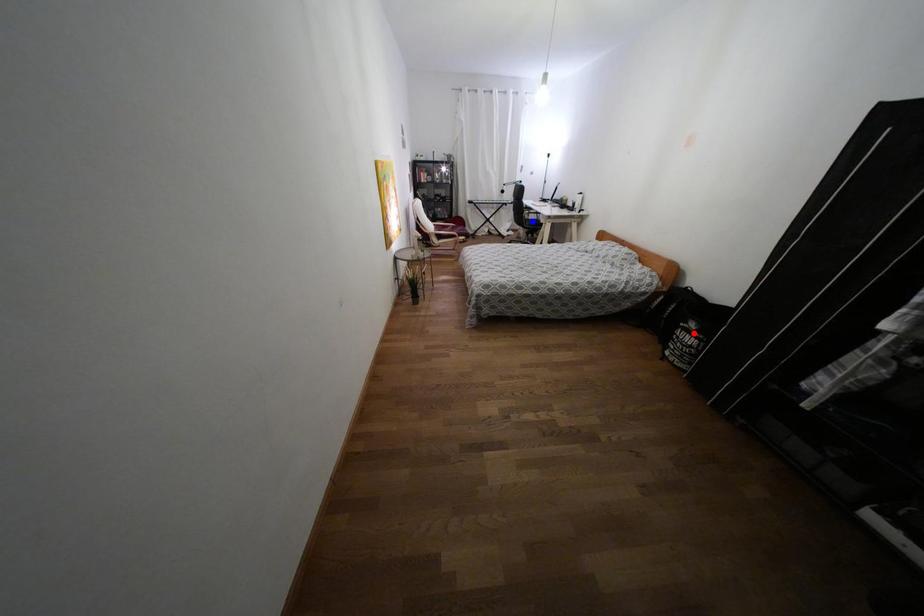
Question: In the image, two points are highlighted. Which point is nearer to the camera? Reply with the corresponding letter.

Choices:
 (A) blue point
 (B) red point

Answer: (B)